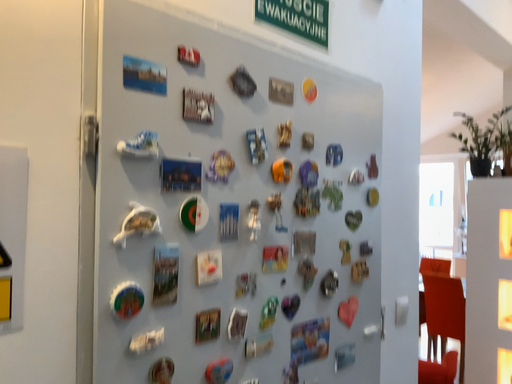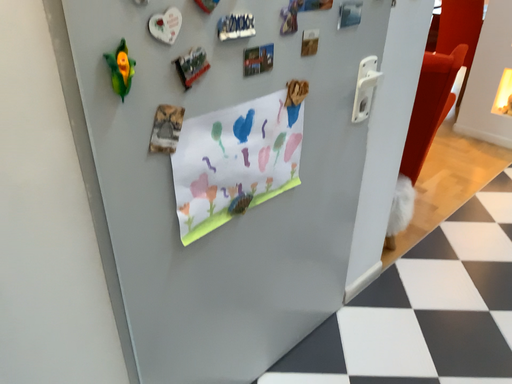
Question: How did the camera likely rotate when shooting the video?

Choices:
 (A) rotated upward
 (B) rotated downward

Answer: (B)